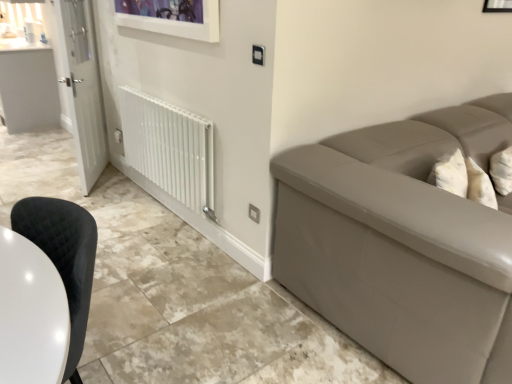
Question: Should I look upward or downward to see white glossy door at left?

Choices:
 (A) up
 (B) down

Answer: (A)

Question: Is black quilted fabric chair at lower left shorter than white glossy radiator at lower left?

Choices:
 (A) yes
 (B) no

Answer: (B)

Question: Can you confirm if black quilted fabric chair at lower left is bigger than white glossy radiator at lower left?

Choices:
 (A) yes
 (B) no

Answer: (A)

Question: From a real-world perspective, is black quilted fabric chair at lower left physically below white glossy radiator at lower left?

Choices:
 (A) yes
 (B) no

Answer: (A)

Question: Is black quilted fabric chair at lower left closer to camera compared to white glossy radiator at lower left?

Choices:
 (A) yes
 (B) no

Answer: (A)

Question: Is black quilted fabric chair at lower left at the right side of white glossy radiator at lower left?

Choices:
 (A) yes
 (B) no

Answer: (B)

Question: Is black quilted fabric chair at lower left at the left side of white glossy radiator at lower left?

Choices:
 (A) no
 (B) yes

Answer: (B)

Question: Is white glossy counter top at upper left bigger than white glossy door at left?

Choices:
 (A) yes
 (B) no

Answer: (A)

Question: Is white glossy counter top at upper left to the left of white glossy door at left from the viewer's perspective?

Choices:
 (A) yes
 (B) no

Answer: (A)

Question: Is white glossy counter top at upper left beside white glossy door at left?

Choices:
 (A) yes
 (B) no

Answer: (B)

Question: Does white glossy counter top at upper left have a smaller size compared to white glossy door at left?

Choices:
 (A) yes
 (B) no

Answer: (B)

Question: Is white glossy counter top at upper left facing towards white glossy door at left?

Choices:
 (A) no
 (B) yes

Answer: (A)

Question: Would you consider white glossy counter top at upper left to be distant from white glossy door at left?

Choices:
 (A) no
 (B) yes

Answer: (B)

Question: Is white glossy door at left with white glossy radiator at lower left?

Choices:
 (A) yes
 (B) no

Answer: (B)